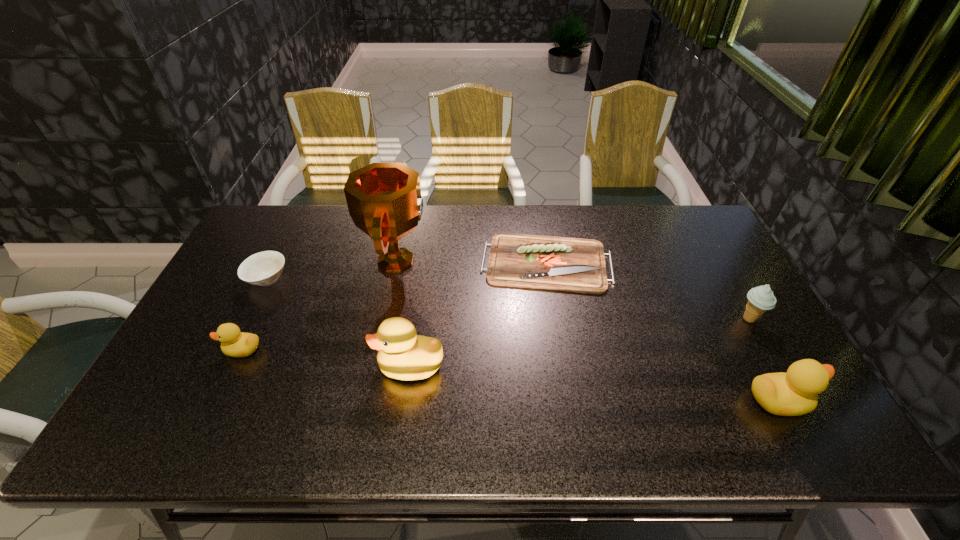
Where is `vacant region located 0.060m on the face of the third shortest object`? This screenshot has width=960, height=540. vacant region located 0.060m on the face of the third shortest object is located at coordinates (201, 349).

In order to click on free region located 0.060m on the face of the third shortest object in this screenshot , I will do `click(201, 349)`.

In order to click on free space located on the face of the second duckling from left to right in this screenshot , I will do pyautogui.click(x=332, y=366).

Identify the location of vacant space located 0.060m on the face of the second duckling from left to right. The image size is (960, 540). (352, 366).

Where is `vacant position located 0.180m on the face of the second duckling from left to right`? The width and height of the screenshot is (960, 540). vacant position located 0.180m on the face of the second duckling from left to right is located at coordinates (305, 366).

Find the location of a particular element. The width and height of the screenshot is (960, 540). vacant space located 0.230m on the right of the sixth tallest object is located at coordinates (364, 279).

Where is `vacant space located 0.120m on the front of the third object from right to left`? This screenshot has width=960, height=540. vacant space located 0.120m on the front of the third object from right to left is located at coordinates tap(557, 326).

Where is `free space located 0.230m on the side of the tallest object with the star emblem`? free space located 0.230m on the side of the tallest object with the star emblem is located at coordinates click(x=501, y=261).

Locate an element on the screen. This screenshot has height=540, width=960. vacant space situated 0.080m on the front of the icecream is located at coordinates (768, 353).

What are the coordinates of `chopping board that is at the far edge` in the screenshot? It's located at (566, 264).